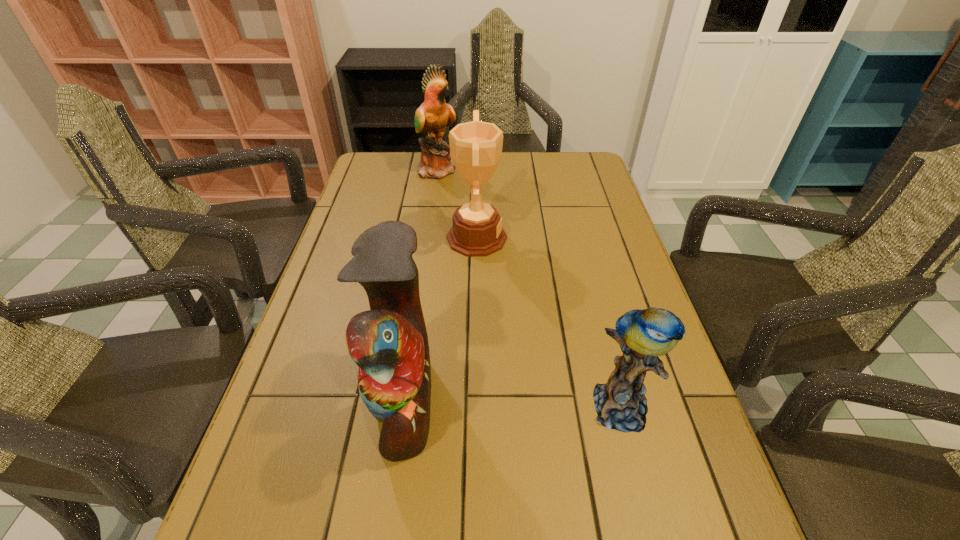
Choose which parrot is the nearest neighbor to the award. Please provide its 2D coordinates. Your answer should be formatted as a tuple, i.e. [(x, y)], where the tuple contains the x and y coordinates of a point satisfying the conditions above.

[(431, 118)]